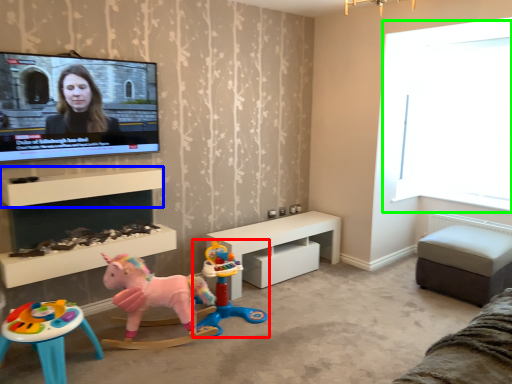
Question: Based on their relative distances, which object is nearer to toy (highlighted by a red box)? Choose from shelf (highlighted by a blue box) and window screen (highlighted by a green box).

Choices:
 (A) shelf
 (B) window screen

Answer: (A)